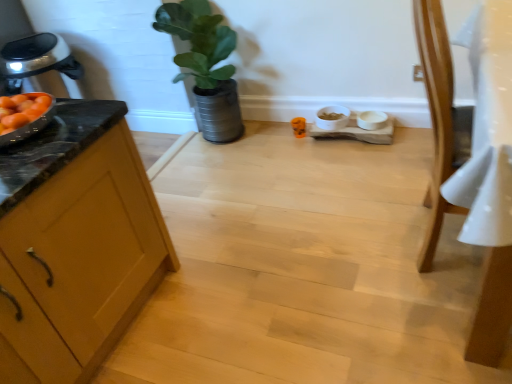
The image size is (512, 384). I want to click on vacant position to the left of light brown wooden chair at right, so click(344, 252).